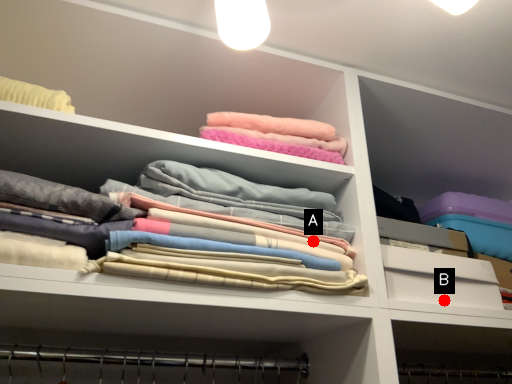
Question: Two points are circled on the image, labeled by A and B beside each circle. Among these points, which one is farthest from the camera?

Choices:
 (A) A is further
 (B) B is further

Answer: (B)